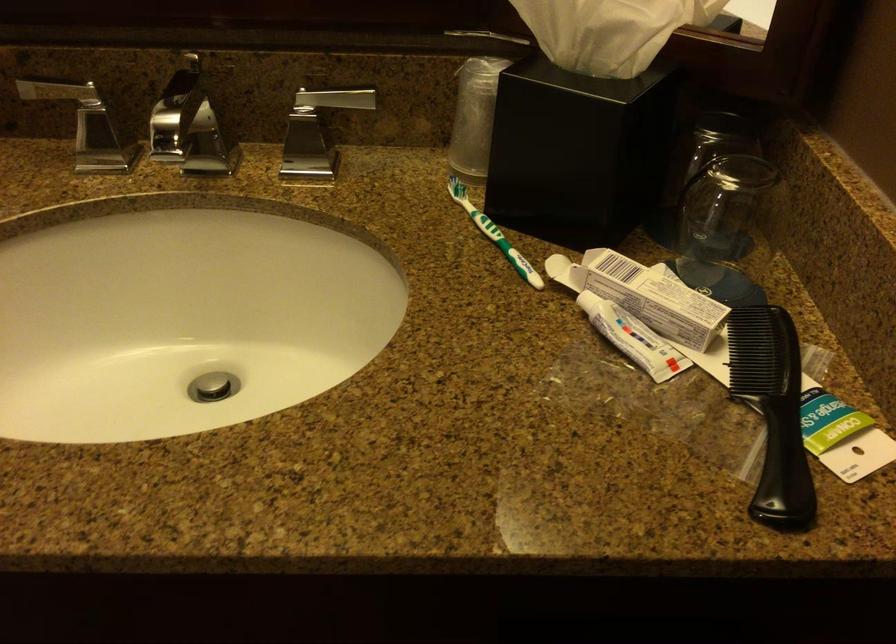
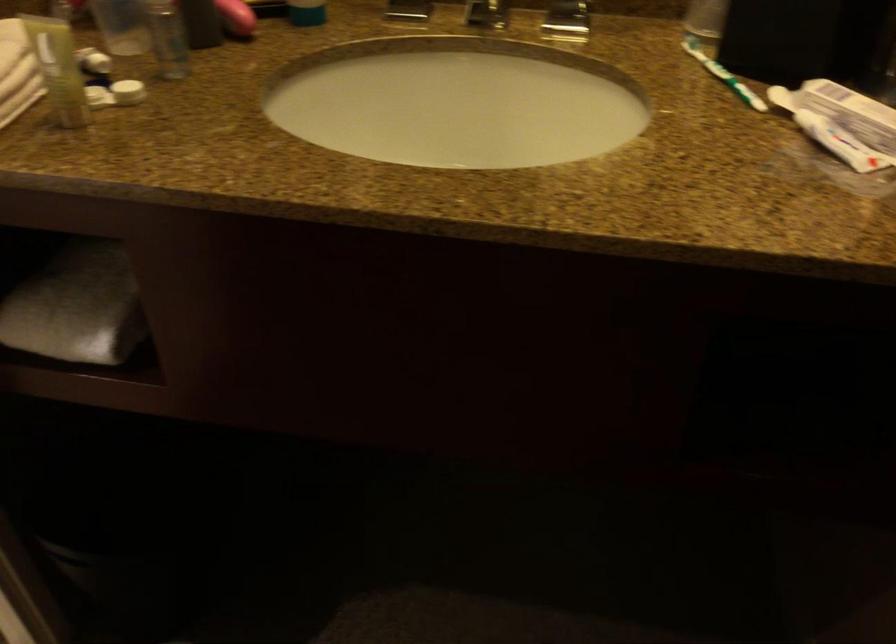
The point at [634,339] is marked in the first image. Where is the corresponding point in the second image?

(840, 143)